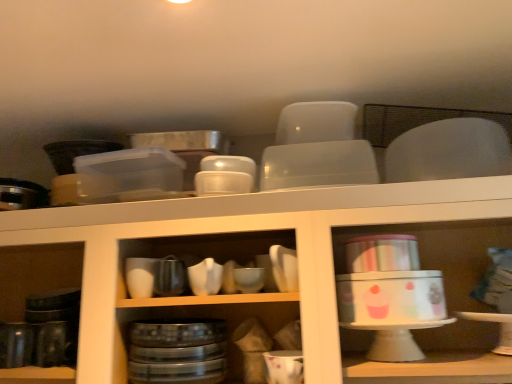
Identify the location of white glossy mug at lower center, placed as the fourth tableware when sorted from left to right. (284, 366).

Where is `white glossy bowl at center, which appears as the fifth tableware when viewed from the left`? The width and height of the screenshot is (512, 384). white glossy bowl at center, which appears as the fifth tableware when viewed from the left is located at coordinates (284, 268).

The height and width of the screenshot is (384, 512). Find the location of `white glossy cake stand at center, the 2th shelf viewed from the right`. white glossy cake stand at center, the 2th shelf viewed from the right is located at coordinates (254, 258).

From a real-world perspective, is white glossy mug at lower center, placed as the fourth tableware when sorted from left to right, on top of matte white bowl at center, which appears as the fourth tableware when viewed from the right?

No, from a real-world perspective, white glossy mug at lower center, placed as the fourth tableware when sorted from left to right, is not above matte white bowl at center, which appears as the fourth tableware when viewed from the right.

Starting from the matte white bowl at center, which appears as the fourth tableware when viewed from the right, which tableware is the 2nd one in front? Please provide its 2D coordinates.

[(284, 366)]

Are white glossy mug at lower center, the second tableware in the right-to-left sequence, and matte white bowl at center, the second tableware from the left, beside each other?

white glossy mug at lower center, the second tableware in the right-to-left sequence, and matte white bowl at center, the second tableware from the left, are clearly separated.

Considering the positions of points (282, 364) and (212, 268), is point (282, 364) farther from camera compared to point (212, 268)?

No, it is not.

Which is behind, white glossy bowl at center, marked as the 3th tableware in a left-to-right arrangement, or metallic tin canister at right, the second shelf when ordered from left to right?

white glossy bowl at center, marked as the 3th tableware in a left-to-right arrangement, is more distant.

Does white glossy bowl at center, marked as the 3th tableware in a left-to-right arrangement, have a greater width compared to metallic tin canister at right, the second shelf when ordered from left to right?

In fact, white glossy bowl at center, marked as the 3th tableware in a left-to-right arrangement, might be narrower than metallic tin canister at right, the second shelf when ordered from left to right.

Is point (255, 286) closer to camera compared to point (416, 371)?

That is False.

Is white glossy cake stand at center, marked as the first shelf in a left-to-right arrangement, taller than white glossy mug at lower center, the second tableware in the right-to-left sequence?

Correct, white glossy cake stand at center, marked as the first shelf in a left-to-right arrangement, is much taller as white glossy mug at lower center, the second tableware in the right-to-left sequence.

Considering the positions of objects white glossy cake stand at center, marked as the first shelf in a left-to-right arrangement, and white glossy mug at lower center, the second tableware in the right-to-left sequence, in the image provided, who is more to the left, white glossy cake stand at center, marked as the first shelf in a left-to-right arrangement, or white glossy mug at lower center, the second tableware in the right-to-left sequence,?

From the viewer's perspective, white glossy cake stand at center, marked as the first shelf in a left-to-right arrangement, appears more on the left side.

Between white glossy cake stand at center, the 2th shelf viewed from the right, and white glossy mug at lower center, the second tableware in the right-to-left sequence, which one has larger size?

With larger size is white glossy cake stand at center, the 2th shelf viewed from the right.

From the picture: Between white glossy cake stand at center, the 2th shelf viewed from the right, and white glossy mug at lower center, placed as the fourth tableware when sorted from left to right, which one has larger width?

With larger width is white glossy cake stand at center, the 2th shelf viewed from the right.

Find the location of a particular element. This screenshot has width=512, height=384. tableware that is the 1st one when counting downward from the metallic tin canister at right, the second shelf when ordered from left to right (from the image's perspective) is located at coordinates (16, 344).

Considering the sizes of shiny black mug at left, arranged as the 1th tableware when viewed from the left, and metallic tin canister at right, the second shelf when ordered from left to right, in the image, is shiny black mug at left, arranged as the 1th tableware when viewed from the left, wider or thinner than metallic tin canister at right, the second shelf when ordered from left to right,?

Considering their sizes, shiny black mug at left, arranged as the 1th tableware when viewed from the left, looks slimmer than metallic tin canister at right, the second shelf when ordered from left to right.

Between shiny black mug at left, arranged as the 1th tableware when viewed from the left, and metallic tin canister at right, which ranks as the first shelf in right-to-left order, which one is positioned behind?

shiny black mug at left, arranged as the 1th tableware when viewed from the left, is further away from the camera.

Are shiny black mug at left, the 5th tableware viewed from the right, and metallic tin canister at right, the second shelf when ordered from left to right, beside each other?

There is a gap between shiny black mug at left, the 5th tableware viewed from the right, and metallic tin canister at right, the second shelf when ordered from left to right.

Which object is further away from the camera taking this photo, white glossy bowl at center, which appears as the fifth tableware when viewed from the left, or matte white bowl at center, the second tableware from the left?

matte white bowl at center, the second tableware from the left, is more distant.

Is white glossy bowl at center, the 1th tableware when ordered from right to left, bigger or smaller than matte white bowl at center, which appears as the fourth tableware when viewed from the right?

Considering their sizes, white glossy bowl at center, the 1th tableware when ordered from right to left, takes up more space than matte white bowl at center, which appears as the fourth tableware when viewed from the right.

Considering the sizes of objects white glossy mug at lower center, placed as the fourth tableware when sorted from left to right, and shiny black mug at left, the 5th tableware viewed from the right, in the image provided, who is thinner, white glossy mug at lower center, placed as the fourth tableware when sorted from left to right, or shiny black mug at left, the 5th tableware viewed from the right,?

Thinner between the two is shiny black mug at left, the 5th tableware viewed from the right.

Could you tell me if white glossy mug at lower center, the second tableware in the right-to-left sequence, is turned towards shiny black mug at left, arranged as the 1th tableware when viewed from the left?

No, white glossy mug at lower center, the second tableware in the right-to-left sequence, is not turned towards shiny black mug at left, arranged as the 1th tableware when viewed from the left.

Considering the relative positions of white glossy mug at lower center, placed as the fourth tableware when sorted from left to right, and shiny black mug at left, arranged as the 1th tableware when viewed from the left, in the image provided, is white glossy mug at lower center, placed as the fourth tableware when sorted from left to right, to the left of shiny black mug at left, arranged as the 1th tableware when viewed from the left, from the viewer's perspective?

No, white glossy mug at lower center, placed as the fourth tableware when sorted from left to right, is not to the left of shiny black mug at left, arranged as the 1th tableware when viewed from the left.

Can we say white glossy bowl at center, which ranks as the third tableware in right-to-left order, lies outside white glossy bowl at center, the 1th tableware when ordered from right to left?

Yes, white glossy bowl at center, which ranks as the third tableware in right-to-left order, is not within white glossy bowl at center, the 1th tableware when ordered from right to left.

Is white glossy bowl at center, which ranks as the third tableware in right-to-left order, next to white glossy bowl at center, the 1th tableware when ordered from right to left?

Yes, white glossy bowl at center, which ranks as the third tableware in right-to-left order, is with white glossy bowl at center, the 1th tableware when ordered from right to left.

Is white glossy bowl at center, which ranks as the third tableware in right-to-left order, aimed at white glossy bowl at center, the 1th tableware when ordered from right to left?

No, white glossy bowl at center, which ranks as the third tableware in right-to-left order, does not turn towards white glossy bowl at center, the 1th tableware when ordered from right to left.

Is white glossy bowl at center, which ranks as the third tableware in right-to-left order, thinner than white glossy bowl at center, which appears as the fifth tableware when viewed from the left?

Yes, white glossy bowl at center, which ranks as the third tableware in right-to-left order, is thinner than white glossy bowl at center, which appears as the fifth tableware when viewed from the left.

Which tableware is the 2nd one when counting from the right side of the matte white bowl at center, the second tableware from the left? Please provide its 2D coordinates.

[(284, 366)]

You are a GUI agent. You are given a task and a screenshot of the screen. Output one action in this format:
    pyautogui.click(x=<x>, y=<y>)
    Task: Click on the 3rd tableware counting from the left side of the metallic tin canister at right, which ranks as the first shelf in right-to-left order
    The width and height of the screenshot is (512, 384).
    Given the screenshot: What is the action you would take?
    pyautogui.click(x=249, y=279)

Looking at the image, which one is located further to white glossy bowl at center, which appears as the fifth tableware when viewed from the left, white glossy bowl at center, marked as the 3th tableware in a left-to-right arrangement, or shiny black mug at left, the 5th tableware viewed from the right?

shiny black mug at left, the 5th tableware viewed from the right, lies further to white glossy bowl at center, which appears as the fifth tableware when viewed from the left, than the other object.

Looking at the image, which one is located further to white glossy bowl at center, which ranks as the third tableware in right-to-left order, metallic tin canister at right, the second shelf when ordered from left to right, or white glossy mug at lower center, placed as the fourth tableware when sorted from left to right?

metallic tin canister at right, the second shelf when ordered from left to right, is further to white glossy bowl at center, which ranks as the third tableware in right-to-left order.

Which object lies further to the anchor point white glossy cake stand at center, the 2th shelf viewed from the right, white glossy bowl at center, which appears as the fifth tableware when viewed from the left, or white glossy mug at lower center, placed as the fourth tableware when sorted from left to right?

white glossy mug at lower center, placed as the fourth tableware when sorted from left to right, is positioned further to the anchor white glossy cake stand at center, the 2th shelf viewed from the right.

When comparing their distances from white glossy cake stand at center, the 2th shelf viewed from the right, does matte white bowl at center, which appears as the fourth tableware when viewed from the right, or white glossy bowl at center, the 1th tableware when ordered from right to left, seem further?

Based on the image, matte white bowl at center, which appears as the fourth tableware when viewed from the right, appears to be further to white glossy cake stand at center, the 2th shelf viewed from the right.

When comparing their distances from shiny black mug at left, the 5th tableware viewed from the right, does metallic tin canister at right, the second shelf when ordered from left to right, or white glossy bowl at center, marked as the 3th tableware in a left-to-right arrangement, seem closer?

white glossy bowl at center, marked as the 3th tableware in a left-to-right arrangement.

From the image, which object appears to be farther from white glossy cake stand at center, marked as the first shelf in a left-to-right arrangement, matte white bowl at center, the second tableware from the left, or white glossy mug at lower center, placed as the fourth tableware when sorted from left to right?

The object further to white glossy cake stand at center, marked as the first shelf in a left-to-right arrangement, is white glossy mug at lower center, placed as the fourth tableware when sorted from left to right.

Looking at the image, which one is located further to shiny black mug at left, the 5th tableware viewed from the right, white glossy bowl at center, the 1th tableware when ordered from right to left, or white glossy bowl at center, which ranks as the third tableware in right-to-left order?

white glossy bowl at center, the 1th tableware when ordered from right to left, is positioned further to the anchor shiny black mug at left, the 5th tableware viewed from the right.

Which object lies further to the anchor point white glossy bowl at center, which ranks as the third tableware in right-to-left order, white glossy mug at lower center, placed as the fourth tableware when sorted from left to right, or matte white bowl at center, which appears as the fourth tableware when viewed from the right?

The object further to white glossy bowl at center, which ranks as the third tableware in right-to-left order, is white glossy mug at lower center, placed as the fourth tableware when sorted from left to right.

Locate an element on the screen. shelf between shiny black mug at left, arranged as the 1th tableware when viewed from the left, and white glossy bowl at center, marked as the 3th tableware in a left-to-right arrangement, in the horizontal direction is located at coordinates (254, 258).

The height and width of the screenshot is (384, 512). Find the location of `tableware situated between shiny black mug at left, arranged as the 1th tableware when viewed from the left, and white glossy bowl at center, marked as the 3th tableware in a left-to-right arrangement, from left to right`. tableware situated between shiny black mug at left, arranged as the 1th tableware when viewed from the left, and white glossy bowl at center, marked as the 3th tableware in a left-to-right arrangement, from left to right is located at coordinates (205, 277).

Where is `shelf situated between shiny black mug at left, the 5th tableware viewed from the right, and white glossy mug at lower center, placed as the fourth tableware when sorted from left to right, from left to right`? The image size is (512, 384). shelf situated between shiny black mug at left, the 5th tableware viewed from the right, and white glossy mug at lower center, placed as the fourth tableware when sorted from left to right, from left to right is located at coordinates (254, 258).

At what (x,y) coordinates should I click in order to perform the action: click on shelf situated between matte white bowl at center, the second tableware from the left, and metallic tin canister at right, the second shelf when ordered from left to right, from left to right. Please return your answer as a coordinate pair (x, y). Image resolution: width=512 pixels, height=384 pixels. Looking at the image, I should click on click(254, 258).